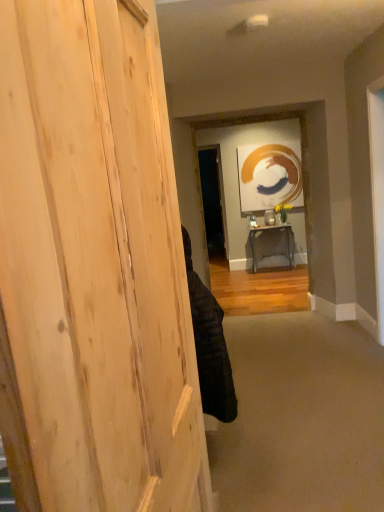
The height and width of the screenshot is (512, 384). Identify the location of free spot above beige carpet at lower center (from a real-world perspective). (302, 366).